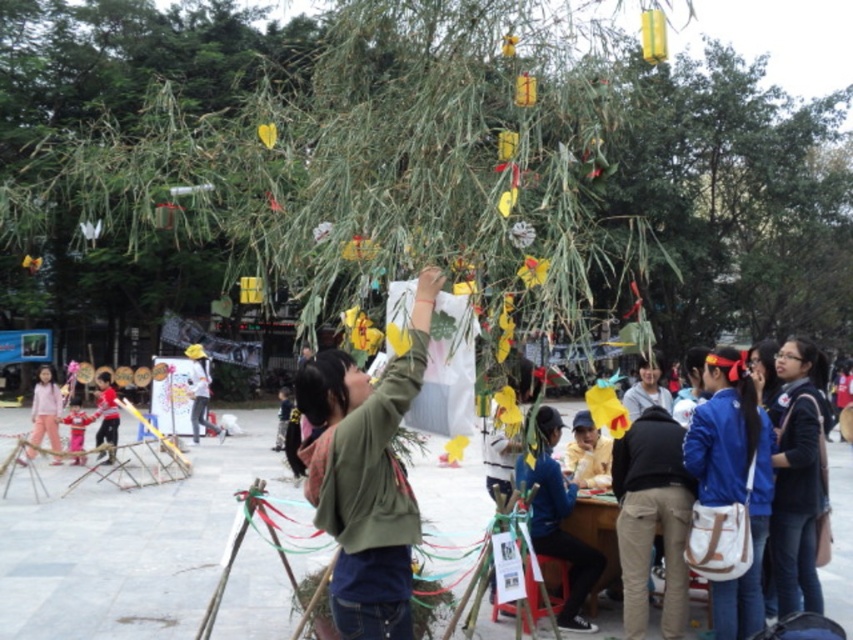
From the picture: Who is taller, black cotton pants at lower right or red shirt at left?

Standing taller between the two is black cotton pants at lower right.

Does black cotton pants at lower right have a greater width compared to red shirt at left?

In fact, black cotton pants at lower right might be narrower than red shirt at left.

Describe the element at coordinates (651, 518) in the screenshot. I see `black cotton pants at lower right` at that location.

The height and width of the screenshot is (640, 853). In order to click on black cotton pants at lower right in this screenshot , I will do `click(651, 518)`.

Does light pink fabric at lower left have a lesser height compared to red shirt at left?

No.

Is light pink fabric at lower left further to the viewer compared to red shirt at left?

No, it is not.

Does point (49, 438) come closer to viewer compared to point (112, 403)?

No.

This screenshot has height=640, width=853. In order to click on light pink fabric at lower left in this screenshot , I will do `click(45, 410)`.

Identify the location of black cotton pants at lower right. The image size is (853, 640). (651, 518).

Locate an element on the screen. This screenshot has width=853, height=640. black cotton pants at lower right is located at coordinates (651, 518).

I want to click on black cotton pants at lower right, so click(x=651, y=518).